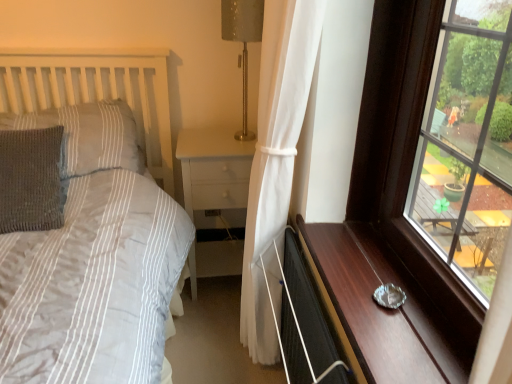
You are a GUI agent. You are given a task and a screenshot of the screen. Output one action in this format:
    pyautogui.click(x=<x>, y=<y>)
    Task: Click on the blank space above metallic silver ashtray at right (from a real-world perspective)
    Image resolution: width=512 pixels, height=384 pixels.
    Given the screenshot: What is the action you would take?
    pyautogui.click(x=374, y=281)